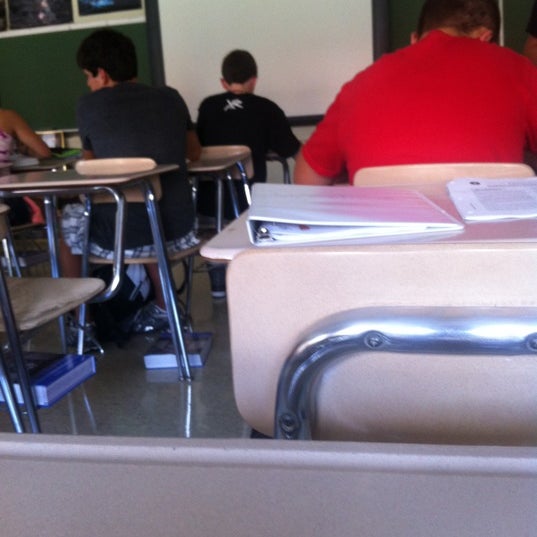
This screenshot has width=537, height=537. What are the coordinates of `chalkboard` in the screenshot? It's located at (55, 76).